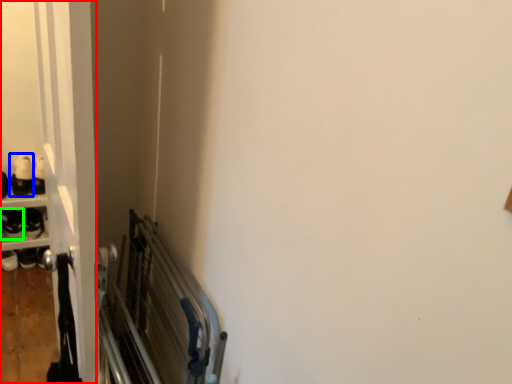
Question: Which object is positioned farthest from door (highlighted by a red box)? Select from footwear (highlighted by a blue box) and footwear (highlighted by a green box).

Choices:
 (A) footwear
 (B) footwear

Answer: (B)